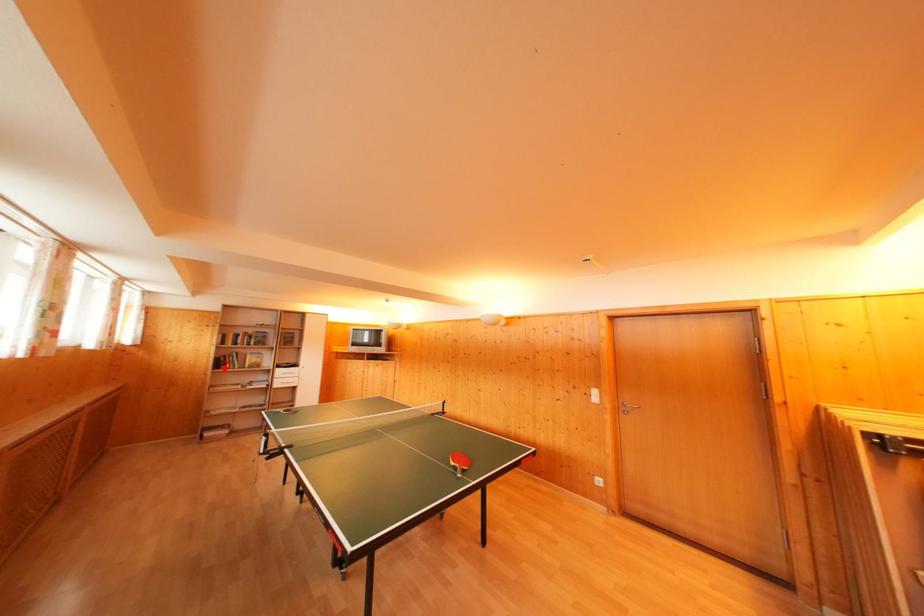
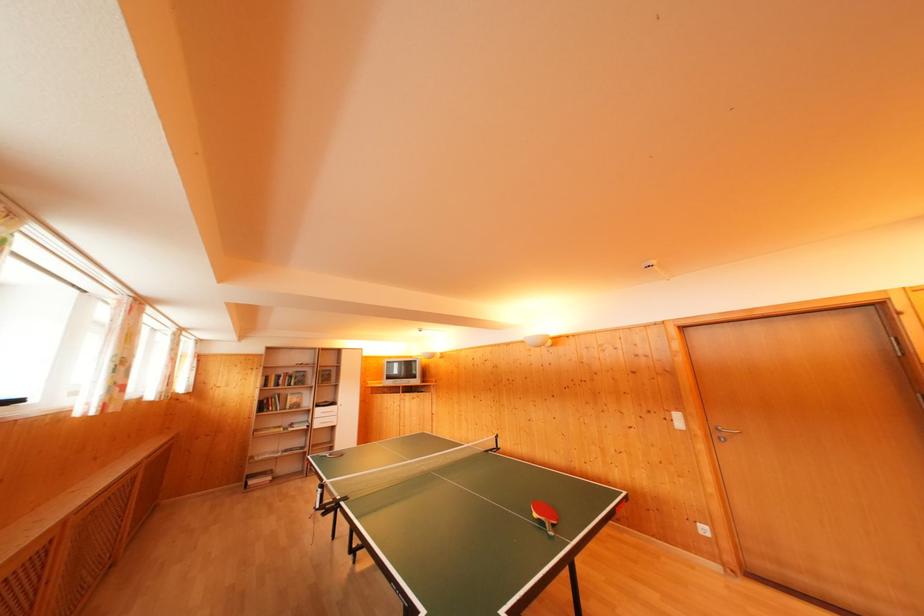
In the second image, find the point that corresponds to the highlighted location in the first image.

(268, 411)